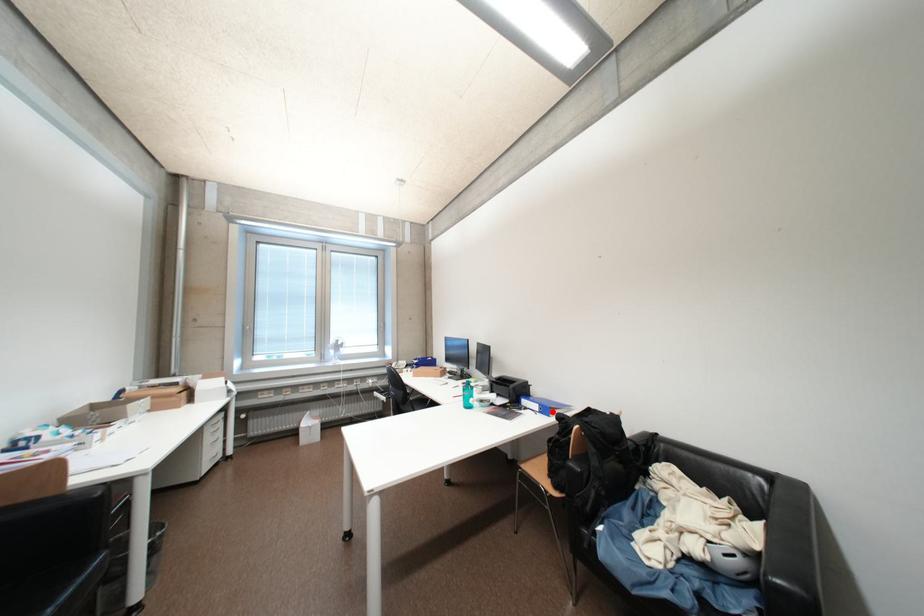
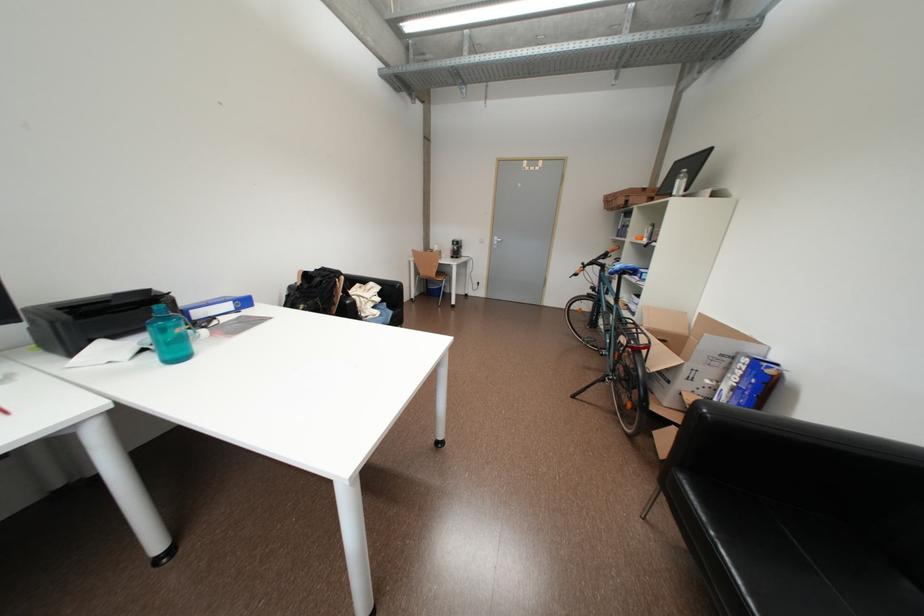
Find the pixel in the second image that matches the highlighted location in the first image.

(252, 304)